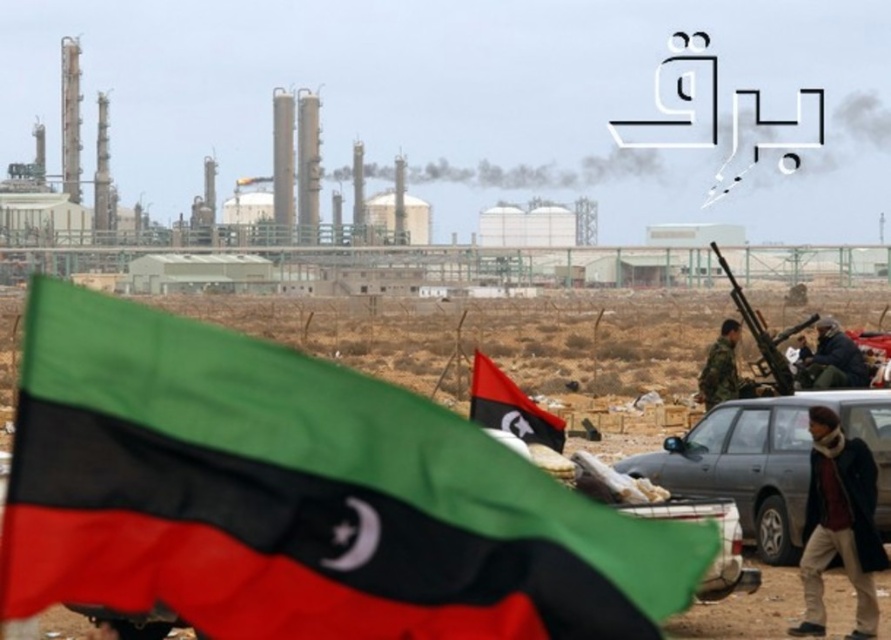
You are a photographer trying to capture the Libyan flag in the center of your photo. You notice a dark blue wool coat at lower right in the scene. Where should you position your camera to ensure the flag is centered while avoiding the coat?

Position your camera so that the Libyan flag is centered in the frame. Since the dark blue wool coat at lower right is located at coordinates approximately 0.820 on the x and 0.943 on the y axis, adjusting the camera slightly to the left or upward will keep the flag centered while moving the coat out of the central area.

Looking at this image, you are a photographer standing at the edge of the industrial facility. You want to take a photo that includes both the red matte flag at center and the camouflage uniform at right. Given that your camera has a maximum focus range of 7 meters, will you be able to capture both subjects in focus without moving your position?

The red matte flag at center is 7.22 meters from the camouflage uniform at right. Since the distance between them exceeds the camera maximum focus range of 7 meters, you won